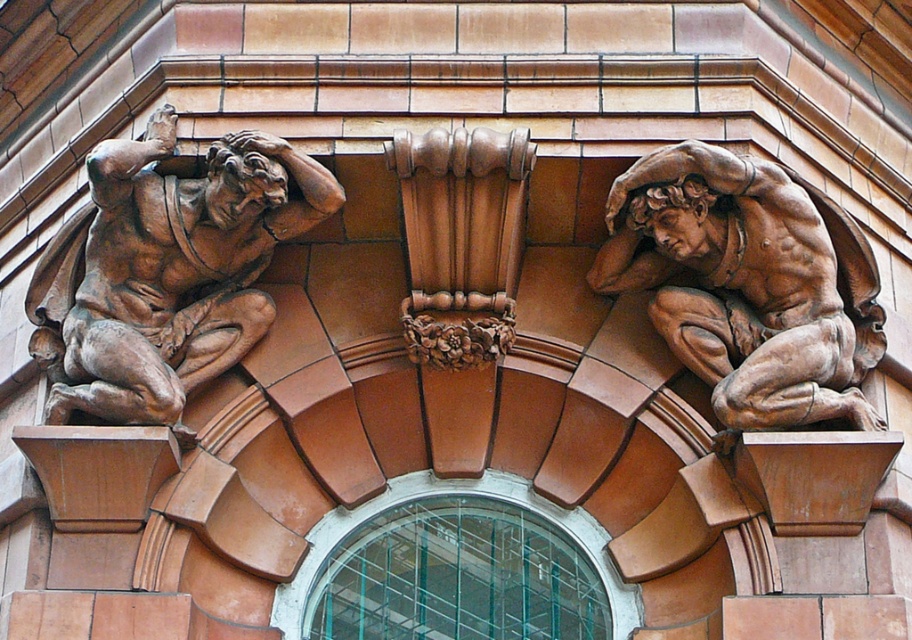
Who is shorter, brown polished stone sculpture at upper left or brown polished stone muscular figure at upper right?

With less height is brown polished stone muscular figure at upper right.

Consider the image. Does brown polished stone sculpture at upper left appear on the left side of brown polished stone muscular figure at upper right?

Correct, you'll find brown polished stone sculpture at upper left to the left of brown polished stone muscular figure at upper right.

Does point (40, 276) come behind point (816, 387)?

Yes, it is behind point (816, 387).

Find the location of a particular element. brown polished stone sculpture at upper left is located at coordinates (164, 272).